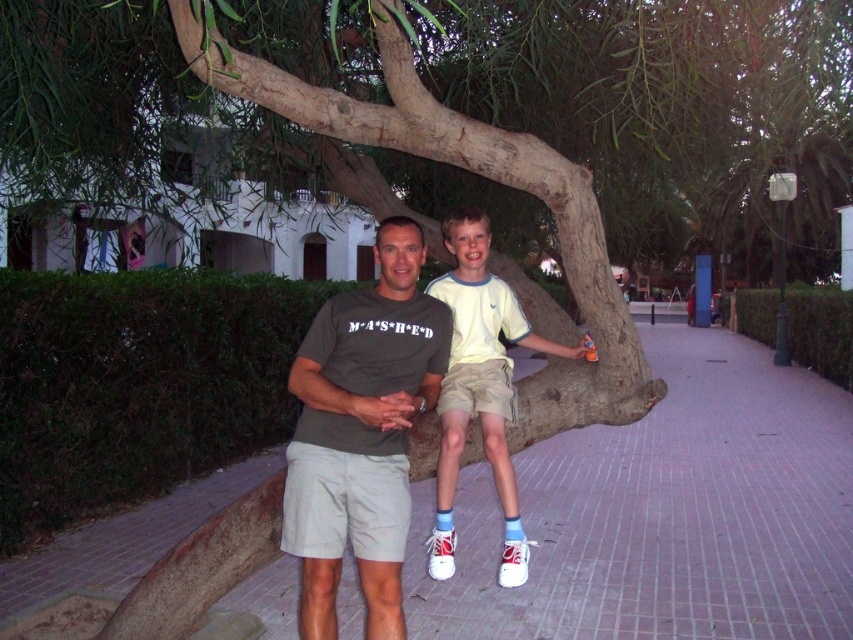
Question: Which object appears farthest from the camera in this image?

Choices:
 (A) matte gray shorts at center
 (B) light yellow t-shirt at center
 (C) brown rough tree trunk at center
 (D) pink brick pavement at center

Answer: (D)

Question: In this image, where is pink brick pavement at center located relative to brown rough tree trunk at center?

Choices:
 (A) left
 (B) right

Answer: (B)

Question: Is brown rough tree trunk at center bigger than matte gray shorts at center?

Choices:
 (A) no
 (B) yes

Answer: (B)

Question: Is brown rough tree trunk at center positioned at the back of matte gray shorts at center?

Choices:
 (A) no
 (B) yes

Answer: (A)

Question: Which of the following is the closest to the observer?

Choices:
 (A) brown rough tree trunk at center
 (B) light yellow t-shirt at center

Answer: (A)

Question: Which object is positioned closest to the matte gray shorts at center?

Choices:
 (A) light yellow t-shirt at center
 (B) brown rough tree trunk at center
 (C) pink brick pavement at center

Answer: (A)